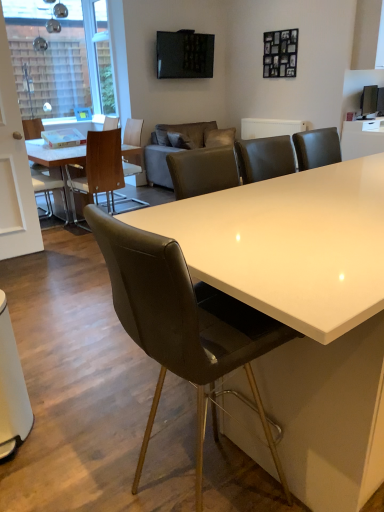
The height and width of the screenshot is (512, 384). Describe the element at coordinates (32, 128) in the screenshot. I see `white leather chair at left, which appears as the third chair when viewed from the front` at that location.

Based on the photo, what is the approximate width of leather at center, the 1th chair from the front?

The width of leather at center, the 1th chair from the front, is 21.12 inches.

Where is `leather at center, the 1th chair from the front`? The image size is (384, 512). leather at center, the 1th chair from the front is located at coordinates (182, 323).

Describe the element at coordinates (133, 132) in the screenshot. I see `woodenchair at left, the fourth chair positioned from the front` at that location.

What is the approximate height of clear glass window screen at upper left?

It is 5.55 feet.

Locate an element on the screen. The image size is (384, 512). matte gray couch at center is located at coordinates (177, 147).

Considering the sizes of objects white glossy door at left and white glossy table at upper right, which is the second table in left-to-right order, in the image provided, who is shorter, white glossy door at left or white glossy table at upper right, which is the second table in left-to-right order,?

Standing shorter between the two is white glossy table at upper right, which is the second table in left-to-right order.

From the image's perspective, which object appears higher, white glossy door at left or white glossy table at upper right, which is the second table in left-to-right order?

white glossy table at upper right, which is the second table in left-to-right order, from the image's perspective.

Which is more to the right, white glossy door at left or white glossy table at upper right, which is the second table in left-to-right order?

Positioned to the right is white glossy table at upper right, which is the second table in left-to-right order.

Is white glossy door at left inside the boundaries of white glossy table at upper right, which is the 1th table from right to left, or outside?

white glossy door at left is located beyond the bounds of white glossy table at upper right, which is the 1th table from right to left.

From the image's perspective, is wooden chair at left, the 3th chair positioned from the back, over leather at center, the 1th chair from the front?

Yes, from the image's perspective, wooden chair at left, the 3th chair positioned from the back, is above leather at center, the 1th chair from the front.

From a real-world perspective, is wooden chair at left, the 3th chair positioned from the back, positioned above or below leather at center, the 1th chair from the front?

wooden chair at left, the 3th chair positioned from the back, is below leather at center, the 1th chair from the front.

Where is `chair lying in front of the wooden chair at left, the 3th chair positioned from the back`? chair lying in front of the wooden chair at left, the 3th chair positioned from the back is located at coordinates (182, 323).

Considering the sizes of matte gray couch at center and clear glass window screen at upper left in the image, is matte gray couch at center wider or thinner than clear glass window screen at upper left?

Clearly, matte gray couch at center has more width compared to clear glass window screen at upper left.

From the image's perspective, is matte gray couch at center beneath clear glass window screen at upper left?

Correct, matte gray couch at center appears lower than clear glass window screen at upper left in the image.

From a real-world perspective, is matte gray couch at center above or below clear glass window screen at upper left?

matte gray couch at center is below clear glass window screen at upper left.

From the image's perspective, relative to clear glass window screen at upper left, is white glossy door at left above or below?

white glossy door at left is below clear glass window screen at upper left.

From the picture: From a real-world perspective, is white glossy door at left located beneath clear glass window screen at upper left?

Correct, in the physical world, white glossy door at left is lower than clear glass window screen at upper left.

Which point is more distant from viewer, (5,194) or (47,99)?

The point (47,99) is more distant.

Is white glossy table at upper right, which is the second table in left-to-right order, completely or partially outside of leather at center, the 1th chair from the front?

white glossy table at upper right, which is the second table in left-to-right order, is positioned outside leather at center, the 1th chair from the front.

From a real-world perspective, is white glossy table at upper right, which is the second table in left-to-right order, on top of leather at center, placed as the fourth chair when sorted from back to front?

Correct, in the physical world, white glossy table at upper right, which is the second table in left-to-right order, is higher than leather at center, placed as the fourth chair when sorted from back to front.

Can you tell me how much white glossy table at upper right, which is the 1th table from right to left, and leather at center, the 1th chair from the front, differ in facing direction?

The facing directions of white glossy table at upper right, which is the 1th table from right to left, and leather at center, the 1th chair from the front, are 89.3 degrees apart.

Is white glossy table at upper right, which is the 1th table from right to left, at the right side of leather at center, the 1th chair from the front?

Correct, you'll find white glossy table at upper right, which is the 1th table from right to left, to the right of leather at center, the 1th chair from the front.

Is white glossy door at left not inside matte wooden table at left, which appears as the 1th table when viewed from the left?

Yes.

In terms of height, does white glossy door at left look taller or shorter compared to matte wooden table at left, which appears as the 1th table when viewed from the left?

Considering their sizes, white glossy door at left has more height than matte wooden table at left, which appears as the 1th table when viewed from the left.

Which point is more distant from viewer, (6,241) or (36,140)?

The point (36,140) is behind.

The width and height of the screenshot is (384, 512). I want to click on window screen above the white leather chair at left, arranged as the 2th chair when viewed from the back (from a real-world perspective), so click(x=48, y=58).

Is point (64, 193) farther from camera compared to point (115, 113)?

No, it is not.

From the image's perspective, which is above, white leather chair at left, which appears as the third chair when viewed from the front, or clear glass window screen at upper left?

clear glass window screen at upper left is shown above in the image.

Considering the sizes of objects white leather chair at left, which appears as the third chair when viewed from the front, and clear glass window screen at upper left in the image provided, who is thinner, white leather chair at left, which appears as the third chair when viewed from the front, or clear glass window screen at upper left?

Thinner between the two is clear glass window screen at upper left.

Where is `the 1st table directly beneath the white glossy door at left (from a real-world perspective)`? the 1st table directly beneath the white glossy door at left (from a real-world perspective) is located at coordinates (362, 138).

Locate an element on the screen. This screenshot has height=512, width=384. the 2nd chair positioned below the wooden chair at left, the 3th chair positioned from the back (from the image's perspective) is located at coordinates (182, 323).

Based on their spatial positions, is matte gray couch at center or clear glass window screen at upper left closer to leather at center, placed as the fourth chair when sorted from back to front?

matte gray couch at center.

From the image, which object appears to be nearer to white glossy table at upper right, which is the second table in left-to-right order, white glossy door at left or wooden chair at left, the 3th chair positioned from the back?

wooden chair at left, the 3th chair positioned from the back.

Considering their positions, is white glossy table at upper right, which is the 1th table from right to left, positioned closer to clear glass window screen at upper left than white leather chair at left, arranged as the 2th chair when viewed from the back?

white leather chair at left, arranged as the 2th chair when viewed from the back, lies closer to clear glass window screen at upper left than the other object.

Looking at the image, which one is located further to white glossy table at upper right, which is the second table in left-to-right order, woodenchair at left, the fourth chair positioned from the front, or clear glass window screen at upper left?

Among the two, clear glass window screen at upper left is located further to white glossy table at upper right, which is the second table in left-to-right order.

Estimate the real-world distances between objects in this image. Which object is closer to matte wooden table at left, placed as the 2th table when sorted from right to left, white glossy table at upper right, which is the 1th table from right to left, or white glossy door at left?

white glossy door at left.

Considering their positions, is wooden chair at left, the second chair viewed from the front, positioned closer to white leather chair at left, arranged as the 2th chair when viewed from the back, than white glossy door at left?

wooden chair at left, the second chair viewed from the front.

In the scene shown: Looking at the image, which one is located closer to white glossy door at left, matte gray couch at center or leather at center, placed as the fourth chair when sorted from back to front?

matte gray couch at center is closer to white glossy door at left.

Looking at the image, which one is located further to matte gray couch at center, wooden chair at left, the 3th chair positioned from the back, or white glossy door at left?

Based on the image, white glossy door at left appears to be further to matte gray couch at center.

Identify the location of table between leather at center, placed as the fourth chair when sorted from back to front, and woodenchair at left, the fourth chair positioned from the front, from front to back. (56, 159).

Where is `table located between wooden chair at left, the 3th chair positioned from the back, and woodenchair at left, the fourth chair positioned from the front, in the depth direction`? table located between wooden chair at left, the 3th chair positioned from the back, and woodenchair at left, the fourth chair positioned from the front, in the depth direction is located at coordinates tap(56, 159).

The width and height of the screenshot is (384, 512). I want to click on glass door located between leather at center, the 1th chair from the front, and clear glass window screen at upper left in the depth direction, so click(x=14, y=168).

Identify the location of couch located between white glossy door at left and white glossy table at upper right, which is the second table in left-to-right order, in the left-right direction. (177, 147).